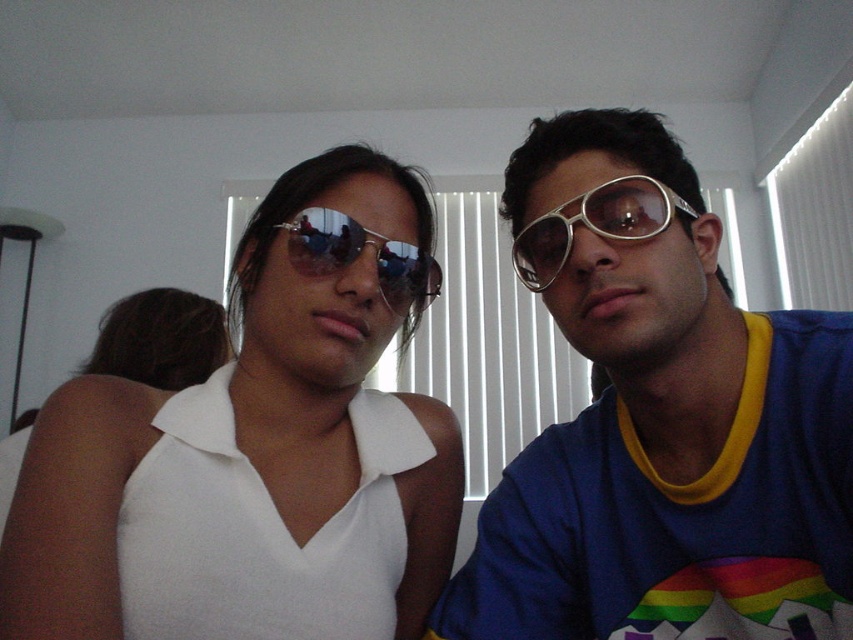
Question: Which of the following is the closest to the observer?

Choices:
 (A) sunglasses at center
 (B) metallic gold sunglasses at upper right

Answer: (B)

Question: Can you confirm if metallic silver goggles at center is smaller than sunglasses at center?

Choices:
 (A) yes
 (B) no

Answer: (A)

Question: Considering the relative positions of metallic silver goggles at center and sunglasses at center in the image provided, where is metallic silver goggles at center located with respect to sunglasses at center?

Choices:
 (A) below
 (B) above

Answer: (B)

Question: Which object appears closest to the camera in this image?

Choices:
 (A) metallic gold sunglasses at upper right
 (B) metallic silver goggles at center
 (C) sunglasses at center

Answer: (A)

Question: Which point is farther from the camera taking this photo?

Choices:
 (A) (390, 308)
 (B) (624, 218)
 (C) (722, 280)

Answer: (C)

Question: Is metallic gold sunglasses at upper right positioned in front of metallic silver goggles at center?

Choices:
 (A) yes
 (B) no

Answer: (A)